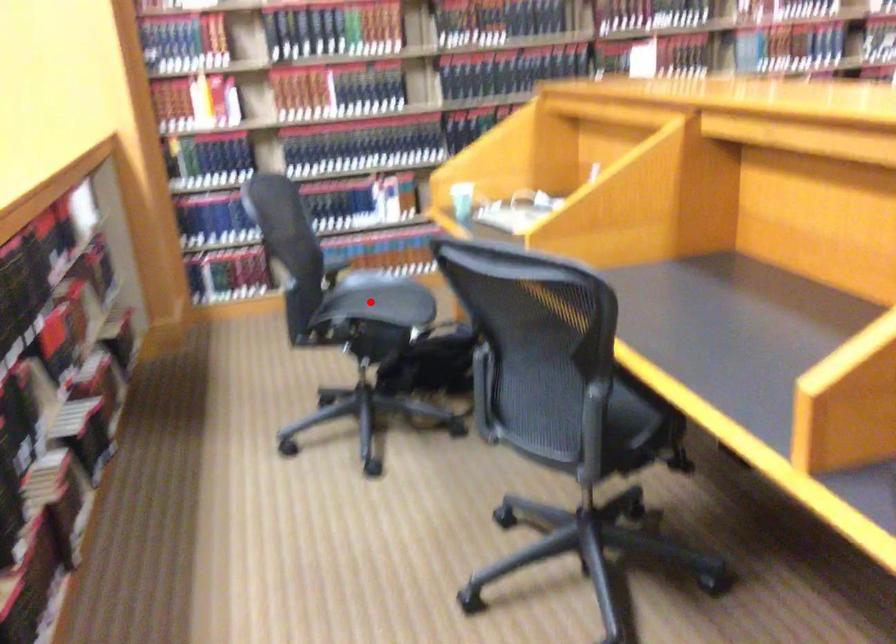
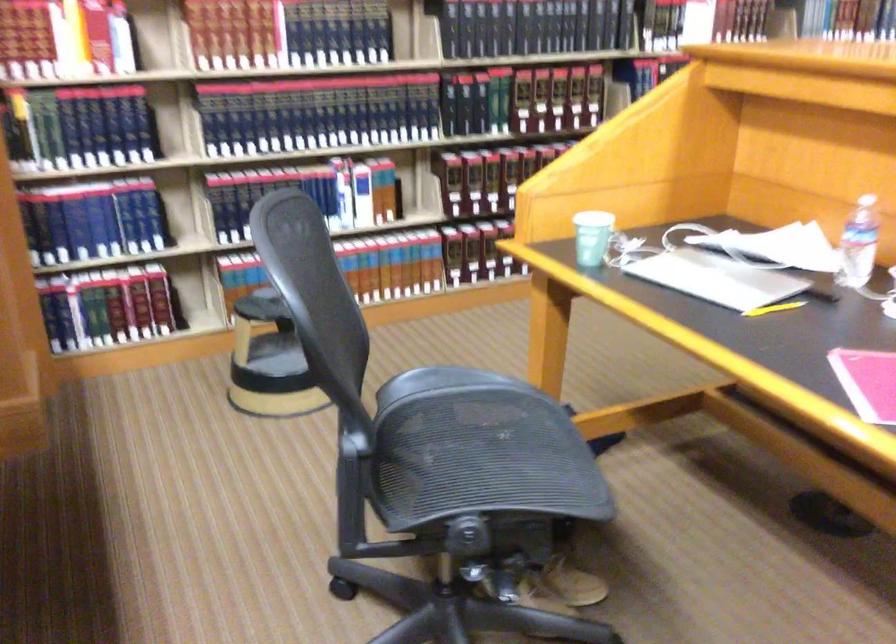
Find the pixel in the second image that matches the highlighted location in the first image.

(470, 442)